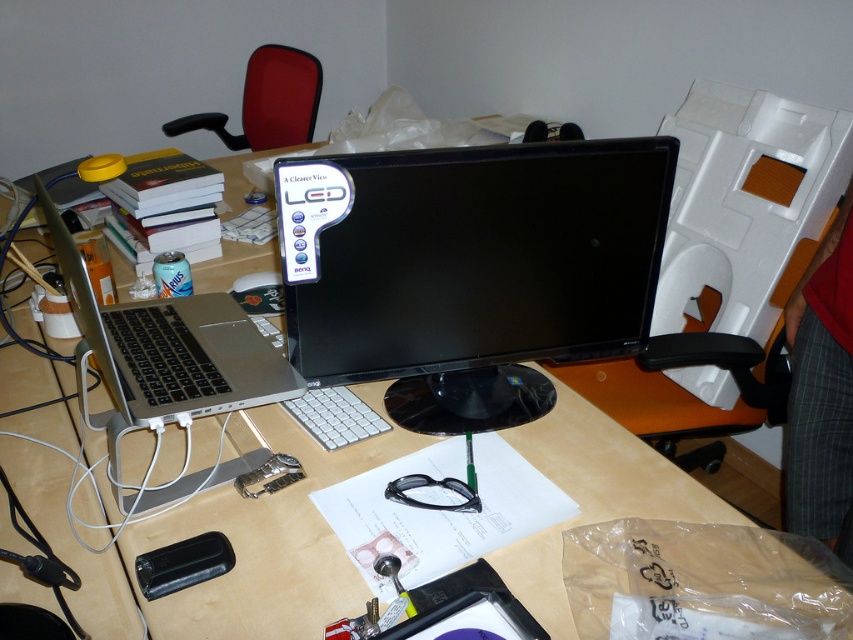
Measure the distance between black glossy monitor at center and satin silver laptop at left.

They are 27.45 centimeters apart.

From the picture: Between black glossy monitor at center and satin silver laptop at left, which one is positioned higher?

black glossy monitor at center is above.

Describe the element at coordinates (469, 269) in the screenshot. I see `black glossy monitor at center` at that location.

Find the location of a particular element. black glossy monitor at center is located at coordinates (469, 269).